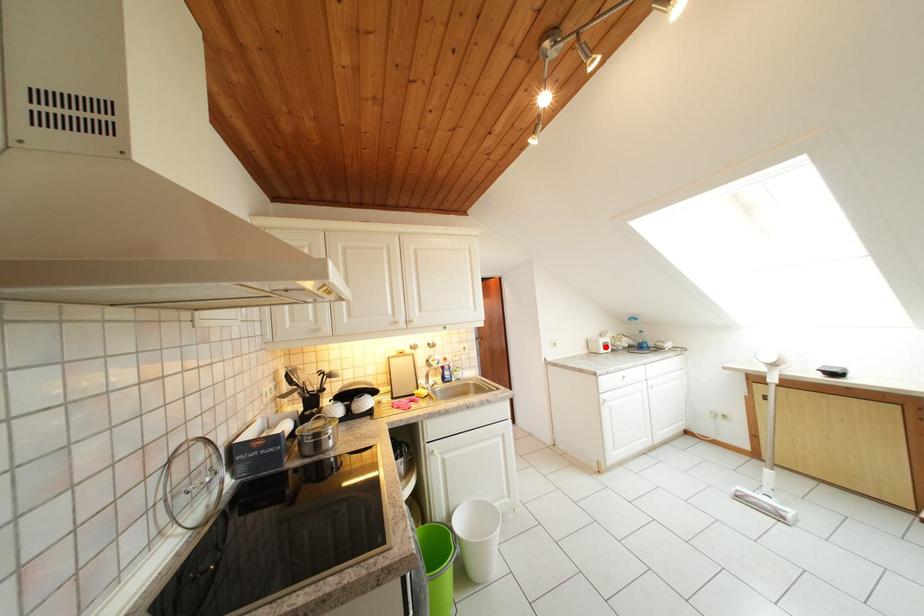
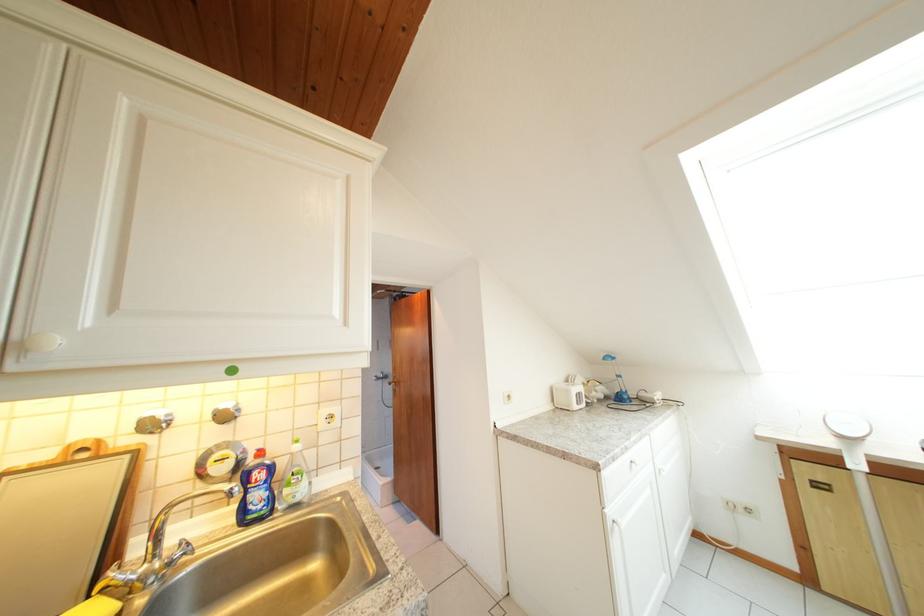
Locate, in the second image, the point that corresponds to the highlighted location in the first image.

(577, 397)